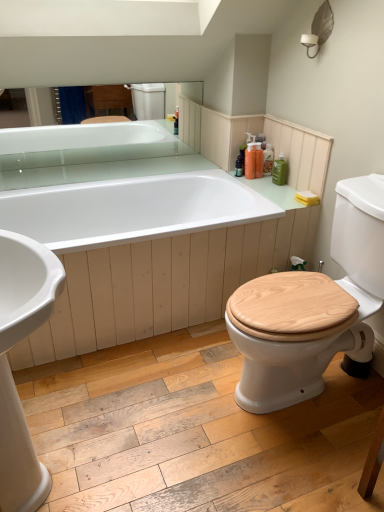
Locate an element on the screen. Image resolution: width=384 pixels, height=512 pixels. blank space to the left of wooden at right is located at coordinates (173, 398).